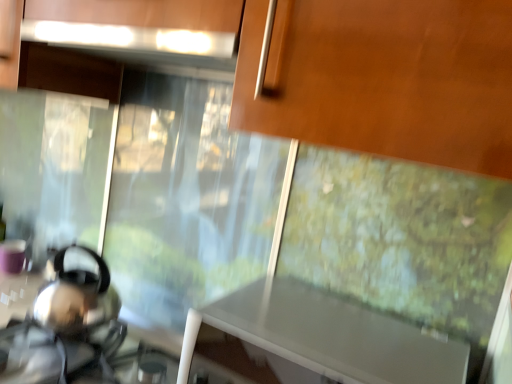
This screenshot has height=384, width=512. I want to click on white glossy table at center, so click(x=328, y=336).

What do you see at coordinates (328, 336) in the screenshot?
I see `white glossy table at center` at bounding box center [328, 336].

Where is `white glossy table at center`? white glossy table at center is located at coordinates (328, 336).